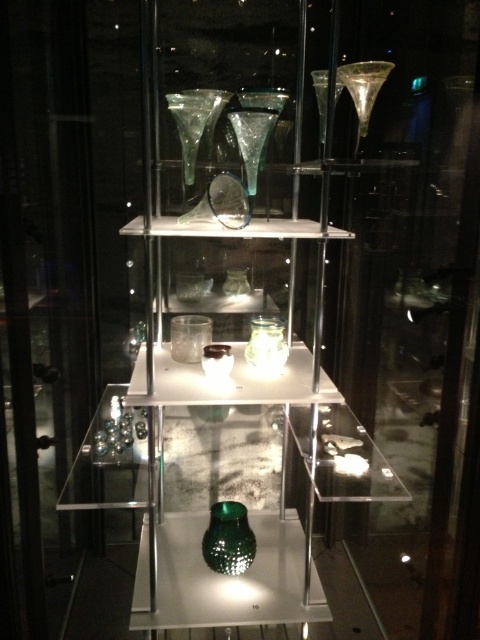
Between green textured glass vase at lower center and translucent glass jar at center, which one is positioned higher?

translucent glass jar at center is above.

The width and height of the screenshot is (480, 640). What are the coordinates of `green textured glass vase at lower center` in the screenshot? It's located at (228, 538).

At what (x,y) coordinates should I click in order to perform the action: click on green textured glass vase at lower center. Please return your answer as a coordinate pair (x, y). The height and width of the screenshot is (640, 480). Looking at the image, I should click on (228, 538).

Is green textured glass at center above transparent glass vase at upper center?

No.

Does green textured glass at center have a lesser height compared to transparent glass vase at upper center?

In fact, green textured glass at center may be taller than transparent glass vase at upper center.

What do you see at coordinates (254, 516) in the screenshot? I see `green textured glass at center` at bounding box center [254, 516].

What are the coordinates of `green textured glass at center` in the screenshot? It's located at point(254,516).

Who is shorter, transparent glass vase at upper center or translucent glass jar at center?

translucent glass jar at center

Which is behind, point (184, 118) or point (268, 369)?

Positioned behind is point (268, 369).

You are a GUI agent. You are given a task and a screenshot of the screen. Output one action in this format:
    pyautogui.click(x=<x>, y=<y>)
    Task: Click on the transparent glass vase at upper center
    
    Given the screenshot: What is the action you would take?
    tap(190, 125)